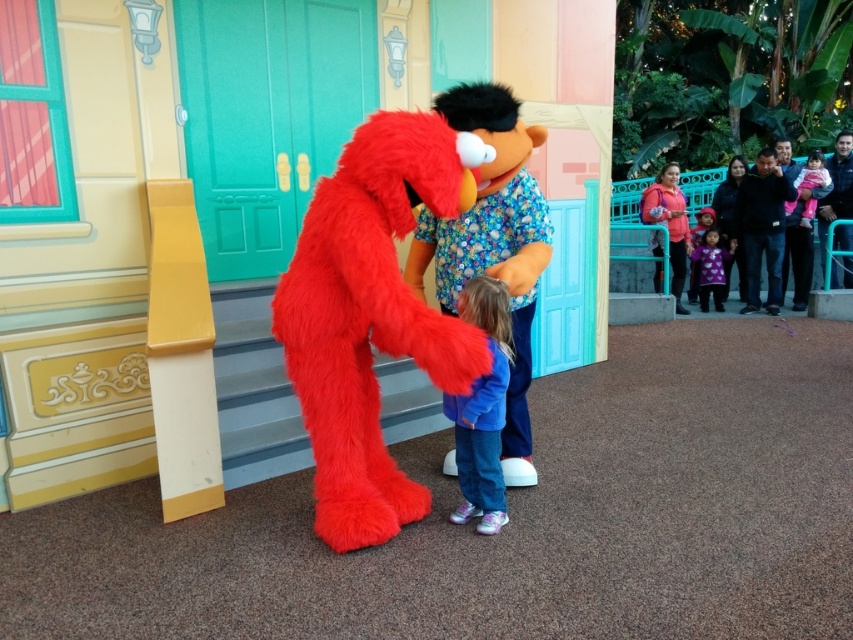
You are a photographer trying to capture a photo of the blue denim jeans at center and the fuzzy red elmo at left. From your current position, which object is more to the left?

The fuzzy red elmo at left is more on the left side of the blue denim jeans at center.

You are a photographer trying to capture a photo of the blue denim jeans at center and the matte pink hoodie at upper right. Since you want both subjects to be in focus, which one should you focus on first to ensure the other is also sharp?

You should focus on the blue denim jeans at center first because it is closer to you than the matte pink hoodie at upper right, so focusing on the closer subject will help keep both in focus.

Looking at this image, you are a photographer trying to capture a photo of both the fuzzy red elmo at left and the blue denim jeans at center. Since you want to ensure both are fully visible in the frame, which object should you position closer to the camera to avoid cropping?

The fuzzy red elmo at left is wider than the blue denim jeans at center, so positioning the fuzzy red elmo at left closer to the camera would allow both to fit within the frame without cropping.